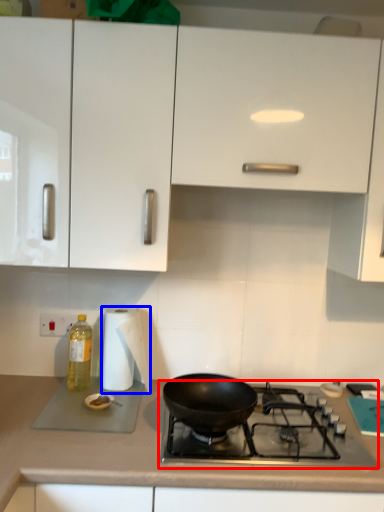
Question: Which object is further to the camera taking this photo, gas stove (highlighted by a red box) or paper towel (highlighted by a blue box)?

Choices:
 (A) gas stove
 (B) paper towel

Answer: (B)